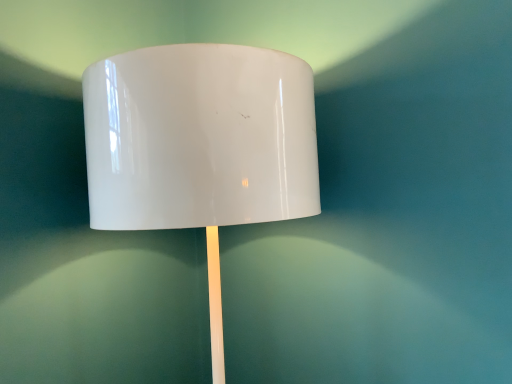
What are the coordinates of `glossy white lampshade at center` in the screenshot? It's located at (200, 145).

The height and width of the screenshot is (384, 512). What do you see at coordinates (200, 145) in the screenshot? I see `glossy white lampshade at center` at bounding box center [200, 145].

What is the approximate width of glossy white lampshade at center?

glossy white lampshade at center is 21.69 inches in width.

What are the coordinates of `glossy white lampshade at center` in the screenshot? It's located at (200, 145).